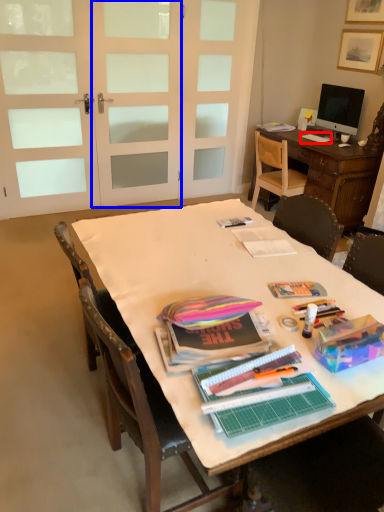
Question: Which of the following is the farthest to the observer, notebook (highlighted by a red box) or screen door (highlighted by a blue box)?

Choices:
 (A) notebook
 (B) screen door

Answer: (A)